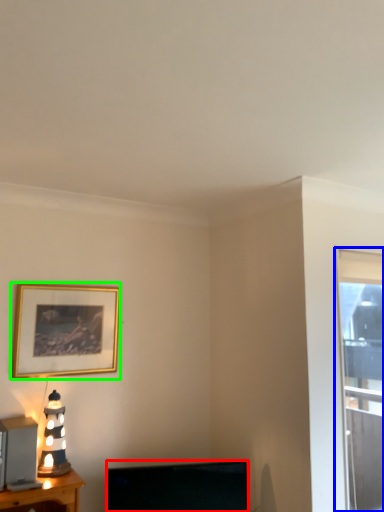
Question: Which object is the closest to the television (highlighted by a red box)? Choose among these: window (highlighted by a blue box) or picture frame (highlighted by a green box).

Choices:
 (A) window
 (B) picture frame

Answer: (B)